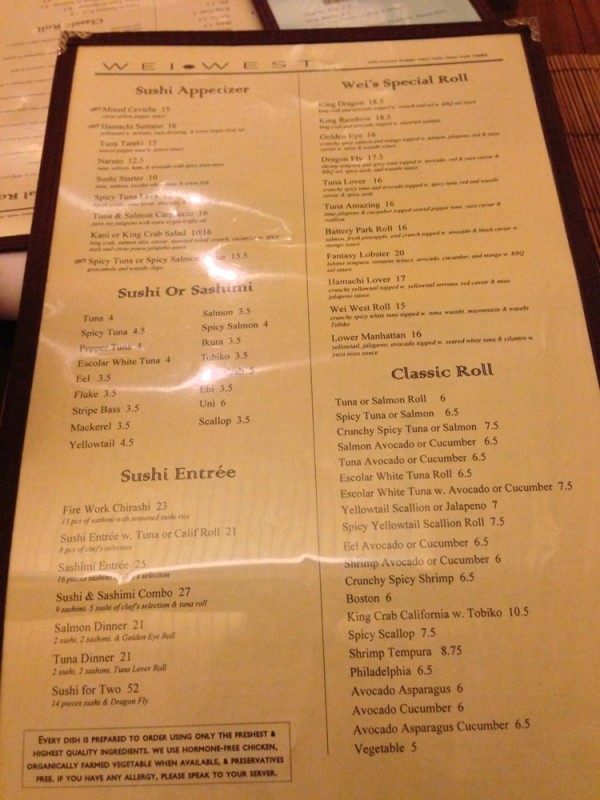
Locate an element on the screen. This screenshot has height=800, width=600. placemat is located at coordinates (584, 262).